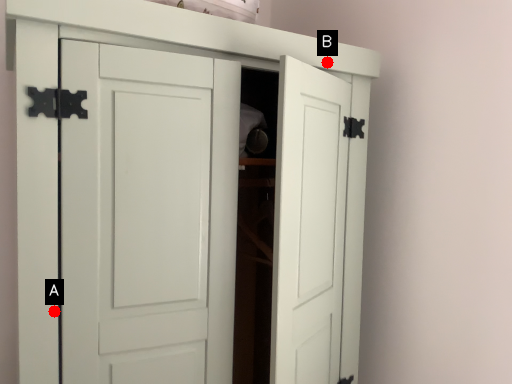
Question: Two points are circled on the image, labeled by A and B beside each circle. Which point is closer to the camera?

Choices:
 (A) A is closer
 (B) B is closer

Answer: (A)